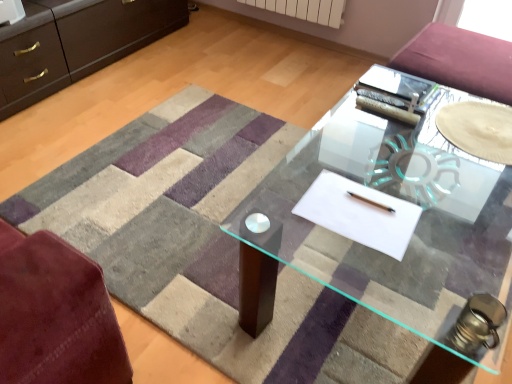
Question: Considering the relative positions of transparent glass plate at center and transparent glass table at center in the image provided, is transparent glass plate at center behind transparent glass table at center?

Choices:
 (A) no
 (B) yes

Answer: (B)

Question: Does transparent glass plate at center have a lesser height compared to transparent glass table at center?

Choices:
 (A) no
 (B) yes

Answer: (B)

Question: From the image's perspective, is transparent glass plate at center beneath transparent glass table at center?

Choices:
 (A) no
 (B) yes

Answer: (A)

Question: Is transparent glass plate at center next to transparent glass table at center?

Choices:
 (A) yes
 (B) no

Answer: (B)

Question: Would you say transparent glass plate at center is a long distance from transparent glass table at center?

Choices:
 (A) yes
 (B) no

Answer: (B)

Question: Is transparent glass table at center in front of or behind white paper at center in the image?

Choices:
 (A) behind
 (B) front

Answer: (A)

Question: Considering the positions of transparent glass table at center and white paper at center in the image, is transparent glass table at center bigger or smaller than white paper at center?

Choices:
 (A) big
 (B) small

Answer: (A)

Question: Is transparent glass table at center wider or thinner than white paper at center?

Choices:
 (A) wide
 (B) thin

Answer: (A)

Question: From a real-world perspective, is transparent glass table at center physically located above or below white paper at center?

Choices:
 (A) below
 (B) above

Answer: (A)

Question: Is point (298, 208) positioned closer to the camera than point (441, 112)?

Choices:
 (A) closer
 (B) farther

Answer: (A)

Question: From the image's perspective, is white paper at center positioned above or below transparent glass plate at center?

Choices:
 (A) above
 (B) below

Answer: (B)

Question: Considering the positions of white paper at center and transparent glass plate at center in the image, is white paper at center wider or thinner than transparent glass plate at center?

Choices:
 (A) wide
 (B) thin

Answer: (B)

Question: In the image, is white paper at center on the left side or the right side of transparent glass plate at center?

Choices:
 (A) right
 (B) left

Answer: (B)

Question: Is point (403, 238) positioned closer to the camera than point (497, 188)?

Choices:
 (A) closer
 (B) farther

Answer: (A)

Question: Visually, is white paper at center positioned to the left or to the right of transparent glass table at center?

Choices:
 (A) right
 (B) left

Answer: (A)